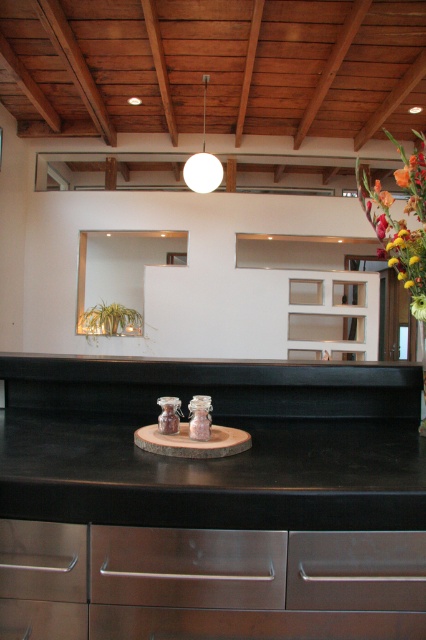
Which is more to the left, stainless steel drawer at lower left or satin brown wood drawer at lower left?

Positioned to the left is stainless steel drawer at lower left.

Is stainless steel drawer at lower left further to camera compared to satin brown wood drawer at lower left?

No, stainless steel drawer at lower left is in front of satin brown wood drawer at lower left.

Where is `stainless steel drawer at lower left`? Image resolution: width=426 pixels, height=640 pixels. stainless steel drawer at lower left is located at coordinates (43, 561).

Does black granite countertop at center have a greater width compared to satin brown wood drawer at lower left?

Indeed, black granite countertop at center has a greater width compared to satin brown wood drawer at lower left.

Who is more distant from viewer, (388, 371) or (28, 618)?

Point (388, 371)

Is point (198, 381) behind point (72, 637)?

That is True.

Where is `black granite countertop at center`? The image size is (426, 640). black granite countertop at center is located at coordinates (216, 499).

Which of these two, stainless steel drawer at center or satin brown wood drawer at lower left, stands shorter?

satin brown wood drawer at lower left

Who is higher up, stainless steel drawer at center or satin brown wood drawer at lower left?

stainless steel drawer at center is higher up.

Which is in front, point (92, 576) or point (62, 628)?

Point (92, 576)

The width and height of the screenshot is (426, 640). I want to click on stainless steel drawer at center, so click(187, 566).